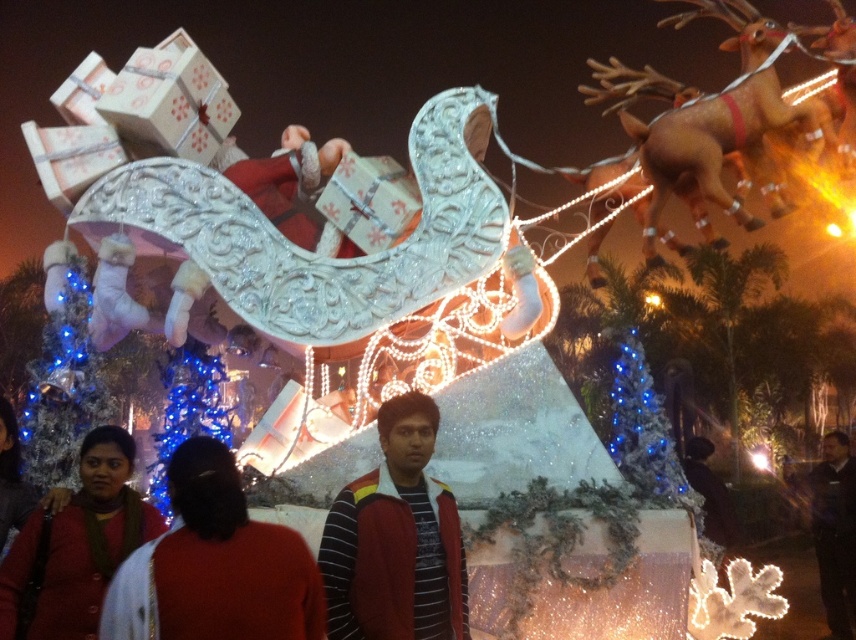
Find the location of a particular element. The height and width of the screenshot is (640, 856). blue glittering christmas tree at lower right is located at coordinates (643, 428).

Is point (638, 403) positioned after point (836, 472)?

No, (638, 403) is in front of (836, 472).

This screenshot has width=856, height=640. Find the location of `blue glittering christmas tree at lower right`. blue glittering christmas tree at lower right is located at coordinates (643, 428).

Can you confirm if striped sweater at center is bigger than blue glittering lights at left?

No, striped sweater at center is not bigger than blue glittering lights at left.

What do you see at coordinates (395, 540) in the screenshot? The width and height of the screenshot is (856, 640). I see `striped sweater at center` at bounding box center [395, 540].

Where is `striped sweater at center`? This screenshot has height=640, width=856. striped sweater at center is located at coordinates (395, 540).

Does red woolen sweater at lower left come behind blue glittering lights at lower left?

No, it is in front of blue glittering lights at lower left.

Describe the element at coordinates (91, 538) in the screenshot. I see `red woolen sweater at lower left` at that location.

The image size is (856, 640). What do you see at coordinates (91, 538) in the screenshot?
I see `red woolen sweater at lower left` at bounding box center [91, 538].

Where is `red woolen sweater at lower left`? red woolen sweater at lower left is located at coordinates (91, 538).